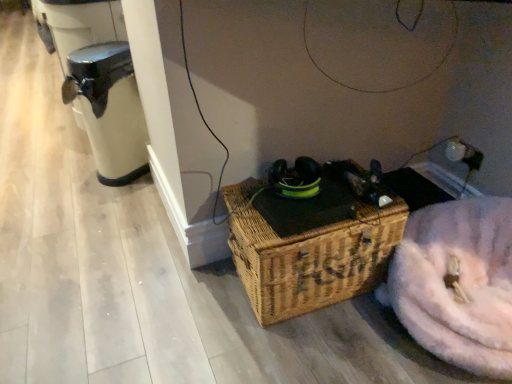
Where is `empty space that is ontop of black plastic water heater at left (from a real-world perspective)`? The height and width of the screenshot is (384, 512). empty space that is ontop of black plastic water heater at left (from a real-world perspective) is located at coordinates (104, 50).